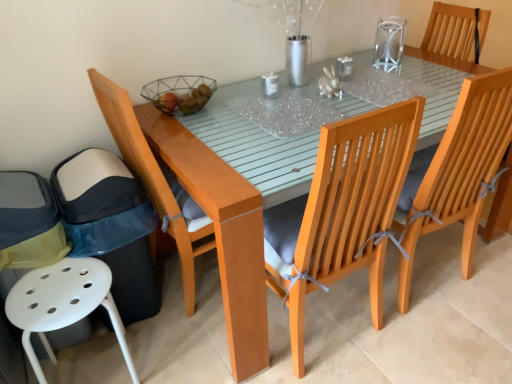
Question: Is wooden chair at upper right, the fifth chair from the left, in front of light brown wood chair at left, positioned as the 4th chair in right-to-left order?

Choices:
 (A) no
 (B) yes

Answer: (A)

Question: From a real-world perspective, is wooden chair at upper right, the fifth chair from the left, beneath light brown wood chair at left, positioned as the 4th chair in right-to-left order?

Choices:
 (A) yes
 (B) no

Answer: (B)

Question: Can you confirm if wooden chair at upper right, which is counted as the 1th chair, starting from the right, is shorter than light brown wood chair at left, the second chair in the left-to-right sequence?

Choices:
 (A) no
 (B) yes

Answer: (B)

Question: From the image's perspective, would you say wooden chair at upper right, the fifth chair from the left, is shown under light brown wood chair at left, positioned as the 4th chair in right-to-left order?

Choices:
 (A) no
 (B) yes

Answer: (A)

Question: Can you confirm if wooden chair at upper right, which is counted as the 1th chair, starting from the right, is positioned to the left of light brown wood chair at left, the second chair in the left-to-right sequence?

Choices:
 (A) no
 (B) yes

Answer: (A)

Question: Considering the positions of point (283, 104) and point (487, 162), is point (283, 104) closer or farther from the camera than point (487, 162)?

Choices:
 (A) farther
 (B) closer

Answer: (A)

Question: Would you say transparent plastic table at center, the 1th glass table viewed from the left, is to the left or to the right of wooden chair with grey cushion at right, acting as the 4th chair starting from the left, in the picture?

Choices:
 (A) left
 (B) right

Answer: (A)

Question: In the image, is transparent plastic table at center, the 1th glass table viewed from the left, positioned in front of or behind wooden chair with grey cushion at right, acting as the 4th chair starting from the left?

Choices:
 (A) behind
 (B) front

Answer: (A)

Question: Is transparent plastic table at center, the second glass table viewed from the right, bigger or smaller than wooden chair with grey cushion at right, acting as the 4th chair starting from the left?

Choices:
 (A) small
 (B) big

Answer: (A)

Question: From a real-world perspective, is transparent glass table at upper center, which ranks as the first glass table in right-to-left order, positioned above or below glossy wood table at center?

Choices:
 (A) above
 (B) below

Answer: (A)

Question: Relative to glossy wood table at center, is transparent glass table at upper center, arranged as the second glass table when viewed from the left, in front or behind?

Choices:
 (A) front
 (B) behind

Answer: (B)

Question: From the image's perspective, is transparent glass table at upper center, which ranks as the first glass table in right-to-left order, located above or below glossy wood table at center?

Choices:
 (A) above
 (B) below

Answer: (A)

Question: Based on their positions, is transparent glass table at upper center, which ranks as the first glass table in right-to-left order, located to the left or right of glossy wood table at center?

Choices:
 (A) right
 (B) left

Answer: (A)

Question: Considering their positions, is wooden chair with grey cushion at center, the 3th chair from the left, located in front of or behind light brown wood chair at left, positioned as the 4th chair in right-to-left order?

Choices:
 (A) behind
 (B) front

Answer: (B)

Question: Is point (328, 142) closer or farther from the camera than point (185, 299)?

Choices:
 (A) closer
 (B) farther

Answer: (A)